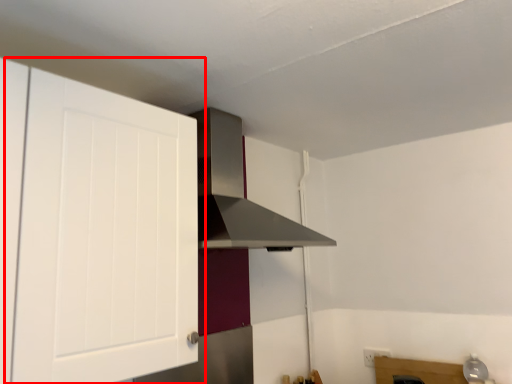
Question: Considering the relative positions of cabinetry (annotated by the red box) and vent in the image provided, where is cabinetry (annotated by the red box) located with respect to the staircase?

Choices:
 (A) right
 (B) left

Answer: (B)